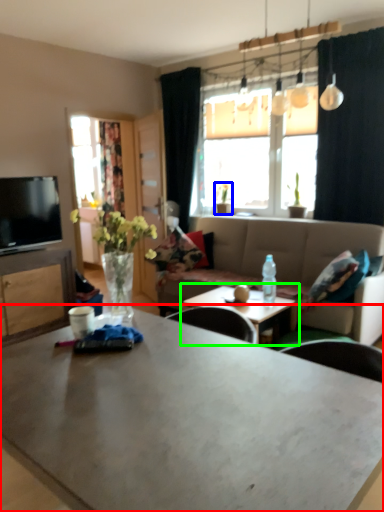
Question: Which is nearer to the coffee table (highlighted by a red box)? houseplant (highlighted by a blue box) or coffee table (highlighted by a green box).

Choices:
 (A) houseplant
 (B) coffee table

Answer: (B)